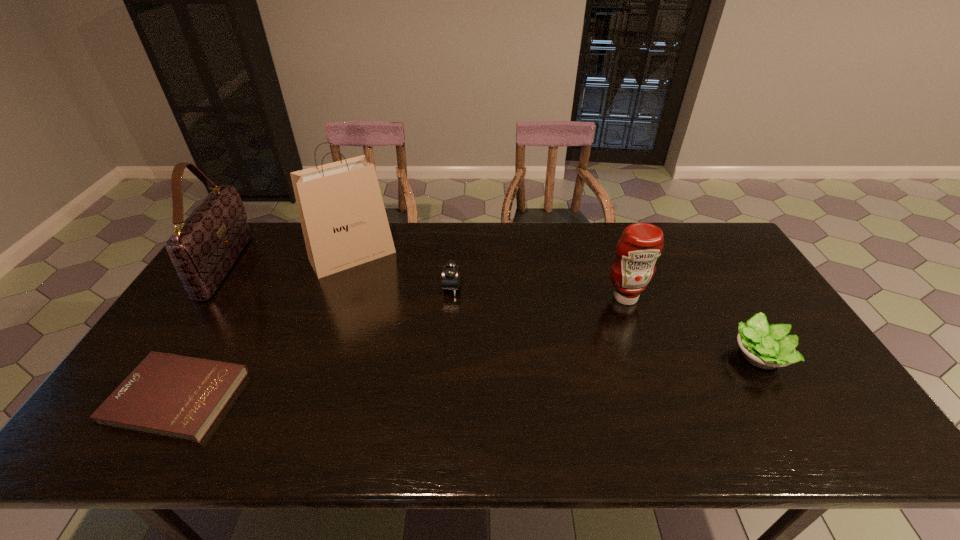
Locate an element on the screen. free spot between the fourth object from left to right and the hardback book is located at coordinates (315, 342).

What are the coordinates of `free point between the third object from left to right and the rightmost object` in the screenshot? It's located at (556, 306).

The image size is (960, 540). In order to click on free point between the second object from right to left and the shopping bag in this screenshot , I will do `click(489, 276)`.

The width and height of the screenshot is (960, 540). In order to click on vacant area that lies between the hardback book and the handbag in this screenshot , I will do `click(202, 332)`.

Where is `vacant area between the third tallest object and the third object from right to left`? vacant area between the third tallest object and the third object from right to left is located at coordinates (539, 293).

Locate an element on the screen. The image size is (960, 540). free spot between the lettuce and the third object from left to right is located at coordinates (556, 306).

Where is `unoccupied area between the shopping bag and the shortest object`? Image resolution: width=960 pixels, height=540 pixels. unoccupied area between the shopping bag and the shortest object is located at coordinates (265, 326).

Select which object is the second closest to the condiment. Please provide its 2D coordinates. Your answer should be formatted as a tuple, i.e. [(x, y)], where the tuple contains the x and y coordinates of a point satisfying the conditions above.

[(451, 272)]

You are a GUI agent. You are given a task and a screenshot of the screen. Output one action in this format:
    pyautogui.click(x=<x>, y=<y>)
    Task: Click on the object that stands as the closest to the fourth object from right to left
    
    Given the screenshot: What is the action you would take?
    pyautogui.click(x=451, y=272)

Locate an element on the screen. This screenshot has width=960, height=540. vacant area that satisfies the following two spatial constraints: 1. on the front of the rightmost object with the clasp; 2. on the left side of the handbag is located at coordinates (165, 355).